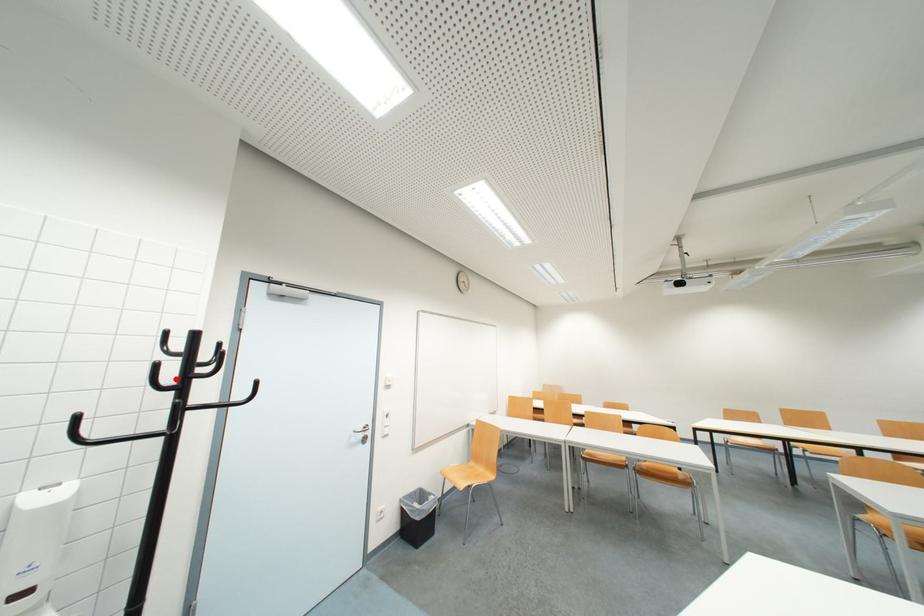
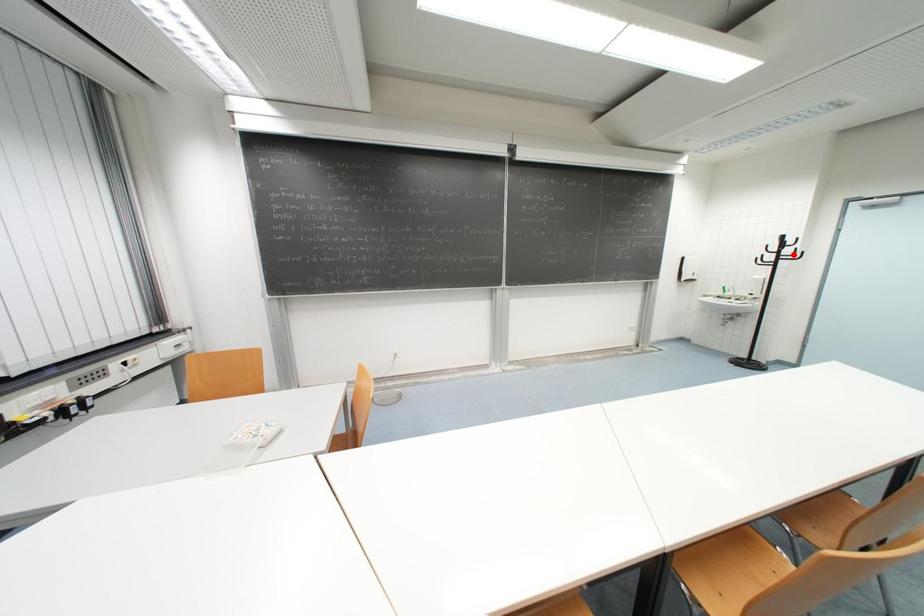
I am providing you with two images of the same scene from different viewpoints. A red point is marked on the first image and another point is marked on the second image. Is the red point in image1 aligned with the point shown in image2?

No